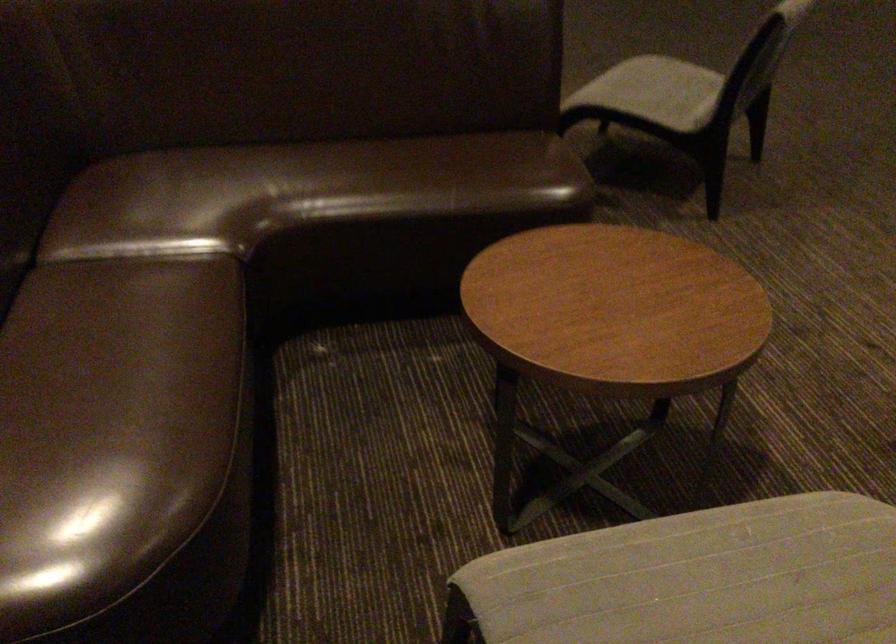
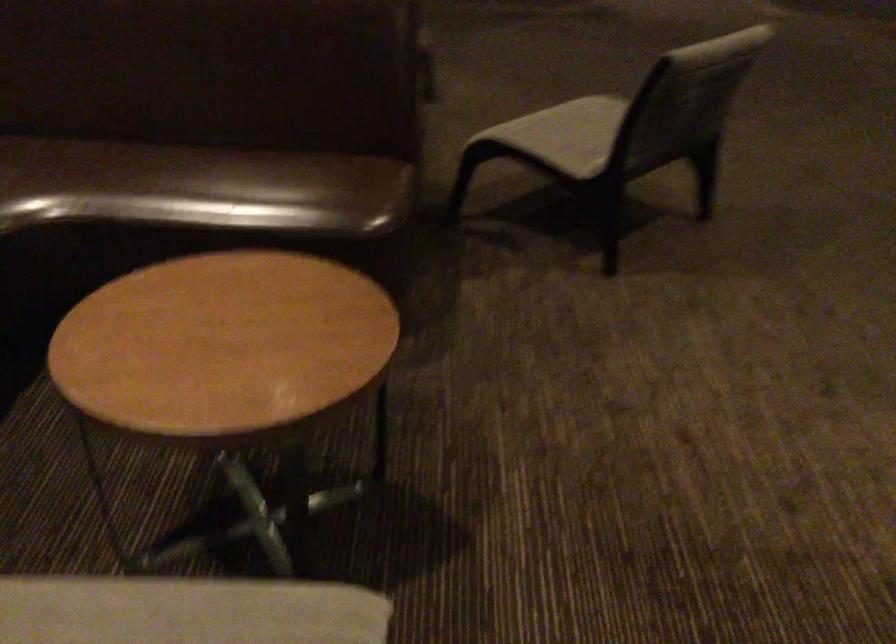
Question: Based on the continuous images, in which direction is the camera rotating? Reply with the corresponding letter.

Choices:
 (A) Left
 (B) Right
 (C) Up
 (D) Down

Answer: (A)